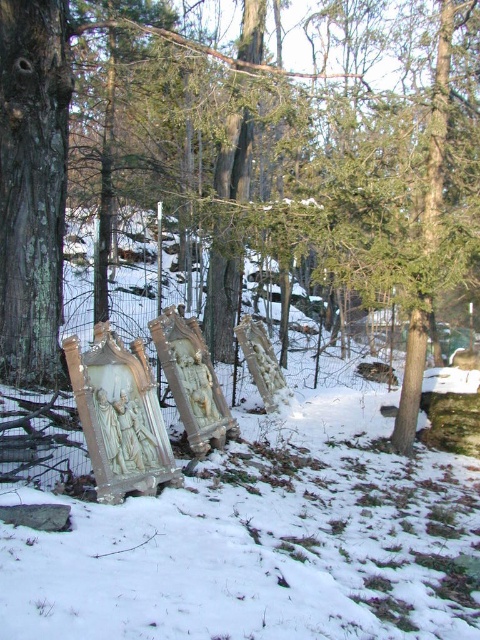
You are an explorer in the winter forest and you see the brown rough tree trunk at left and the white matte snow at center. Which object is positioned more to the east if the sun is setting in the west?

The brown rough tree trunk at left is positioned more to the east than the white matte snow at center because it is to the right of it, and if the sun is setting in the west, the right side would be east.

You are an artist trying to sketch the winter scene. You notice the brown rough tree trunk at left and the white matte snow at center. Which object should you draw first if you want to emphasize the larger element in your drawing?

The brown rough tree trunk at left should be drawn first because it has a larger size compared to the white matte snow at center, allowing you to emphasize its prominence in the scene.